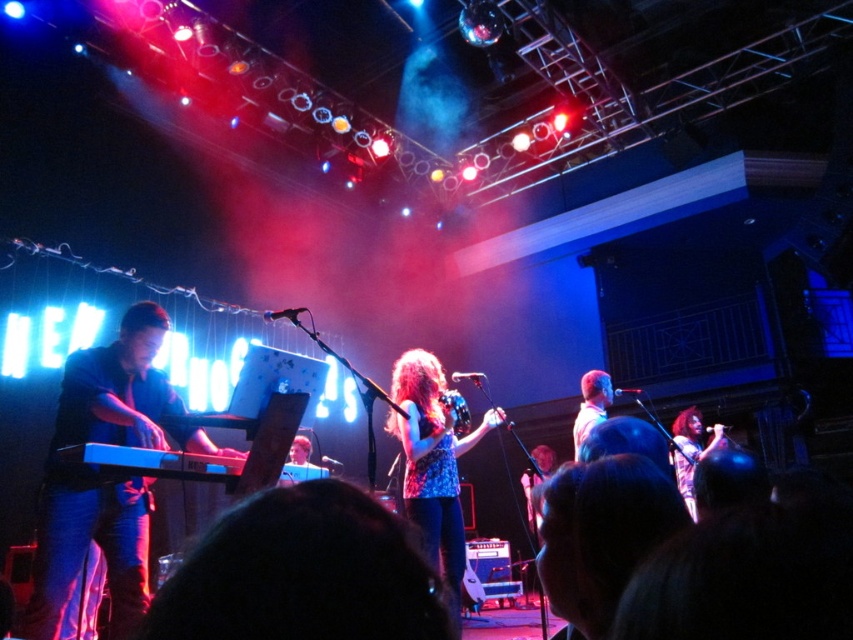
Question: Considering the relative positions of light brown hair at center and floral dress at center in the image provided, where is light brown hair at center located with respect to floral dress at center?

Choices:
 (A) left
 (B) right

Answer: (A)

Question: Estimate the real-world distances between objects in this image. Which object is closer to the blue denim jeans at center?

Choices:
 (A) floral dress at center
 (B) floral-patterned top at center
 (C) floral-patterned dress at center

Answer: (B)

Question: Does floral dress at center have a larger size compared to blue denim jeans at center?

Choices:
 (A) no
 (B) yes

Answer: (A)

Question: Is floral-patterned dress at center thinner than light brown hair at center?

Choices:
 (A) no
 (B) yes

Answer: (A)

Question: Estimate the real-world distances between objects in this image. Which object is farther from the blue denim jeans at center?

Choices:
 (A) floral-patterned dress at center
 (B) floral-patterned top at center
 (C) floral dress at center

Answer: (C)

Question: Which point appears closest to the camera in this image?

Choices:
 (A) (595, 412)
 (B) (299, 444)

Answer: (A)